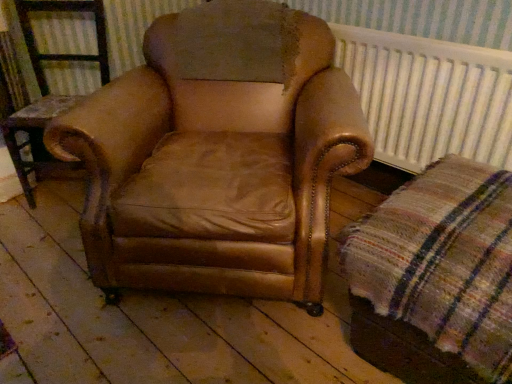
Question: Considering the relative positions of white textured radiator at upper right and brown leather armchair at center in the image provided, is white textured radiator at upper right to the right of brown leather armchair at center from the viewer's perspective?

Choices:
 (A) no
 (B) yes

Answer: (B)

Question: Is white textured radiator at upper right facing towards brown leather armchair at center?

Choices:
 (A) yes
 (B) no

Answer: (A)

Question: Can you confirm if white textured radiator at upper right is thinner than brown leather armchair at center?

Choices:
 (A) no
 (B) yes

Answer: (B)

Question: Is white textured radiator at upper right turned away from brown leather armchair at center?

Choices:
 (A) yes
 (B) no

Answer: (B)

Question: From the image's perspective, is white textured radiator at upper right above brown leather armchair at center?

Choices:
 (A) yes
 (B) no

Answer: (A)

Question: Is brown leather armchair at center located within white textured radiator at upper right?

Choices:
 (A) yes
 (B) no

Answer: (B)

Question: From a real-world perspective, is white textured radiator at upper right on brown leather armchair at center?

Choices:
 (A) no
 (B) yes

Answer: (B)

Question: Is white textured radiator at upper right smaller than brown leather armchair at center?

Choices:
 (A) yes
 (B) no

Answer: (A)

Question: Is the depth of white textured radiator at upper right greater than that of brown leather armchair at center?

Choices:
 (A) yes
 (B) no

Answer: (B)

Question: Can you confirm if white textured radiator at upper right is shorter than brown leather armchair at center?

Choices:
 (A) yes
 (B) no

Answer: (A)

Question: From the image's perspective, would you say white textured radiator at upper right is shown under brown leather armchair at center?

Choices:
 (A) yes
 (B) no

Answer: (A)

Question: Can you confirm if white textured radiator at upper right is bigger than brown leather armchair at center?

Choices:
 (A) yes
 (B) no

Answer: (B)

Question: Are brown leather armchair at center and plaid fabric at lower right far apart?

Choices:
 (A) no
 (B) yes

Answer: (A)